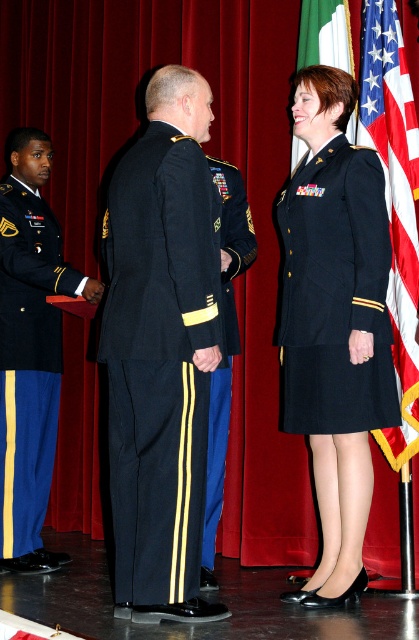
Question: Which point is farther to the camera?

Choices:
 (A) navy blue wool dress uniform at center
 (B) shiny black jacket at center
 (C) navy blue fabric uniform at center
 (D) blue wool uniform at left

Answer: (D)

Question: Is the position of navy blue fabric uniform at center less distant than that of green fabric flag at upper center?

Choices:
 (A) no
 (B) yes

Answer: (B)

Question: Which object appears farthest from the camera in this image?

Choices:
 (A) shiny black jacket at center
 (B) navy blue wool dress uniform at center
 (C) navy blue fabric uniform at center

Answer: (A)

Question: From the image, what is the correct spatial relationship of blue wool uniform at left in relation to american flag at right?

Choices:
 (A) right
 (B) left

Answer: (B)

Question: Can you confirm if shiny black jacket at center is wider than green fabric flag at upper center?

Choices:
 (A) no
 (B) yes

Answer: (A)

Question: Which point appears farthest from the camera in this image?

Choices:
 (A) (313, 49)
 (B) (369, 60)
 (C) (250, 248)

Answer: (A)